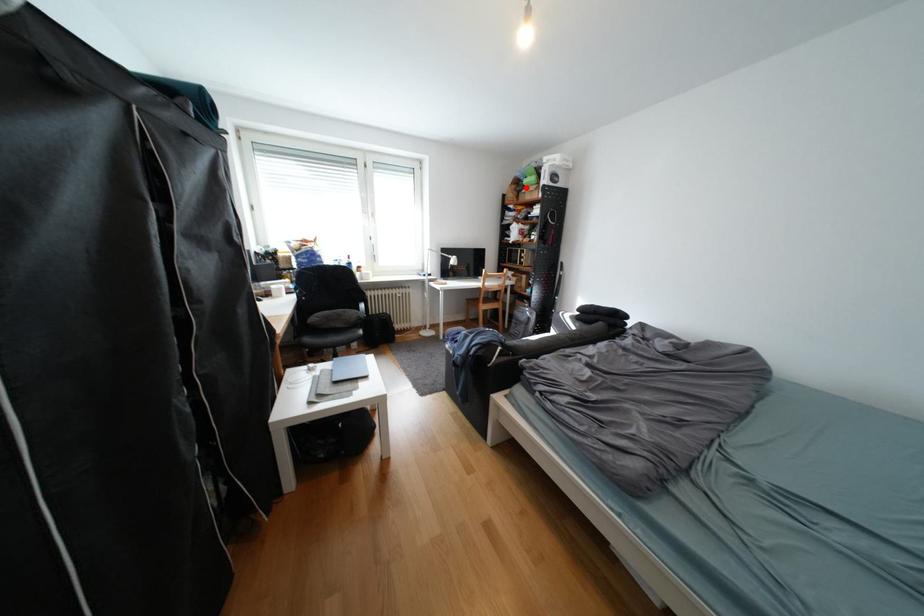
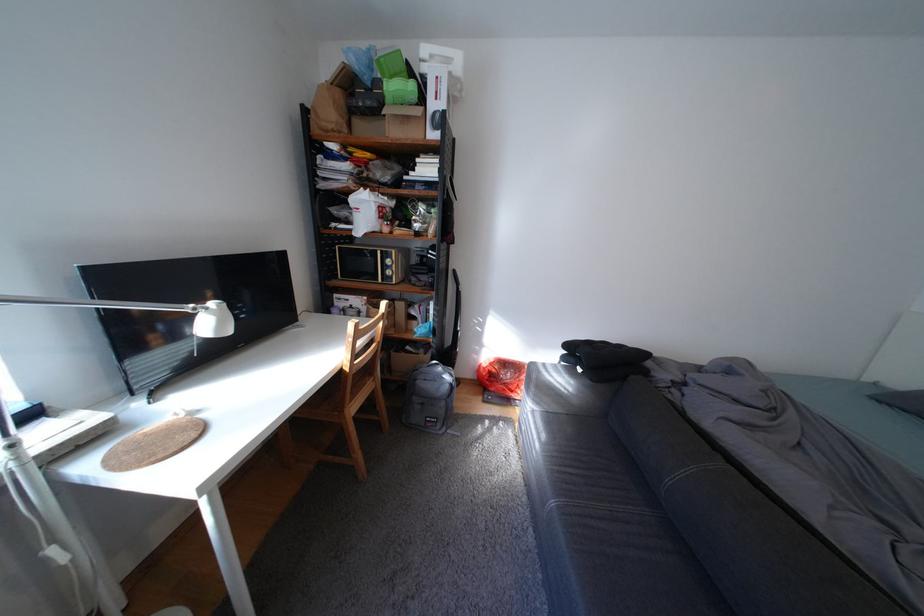
The point at the highlighted location is marked in the first image. Where is the corresponding point in the second image?

(351, 95)